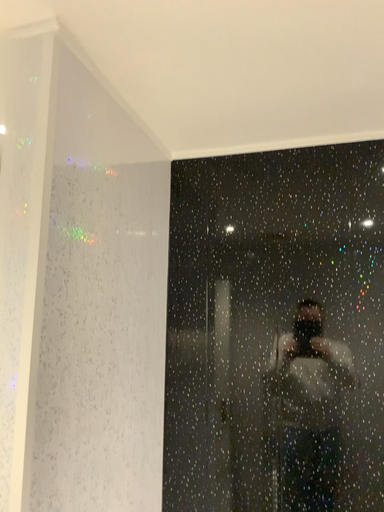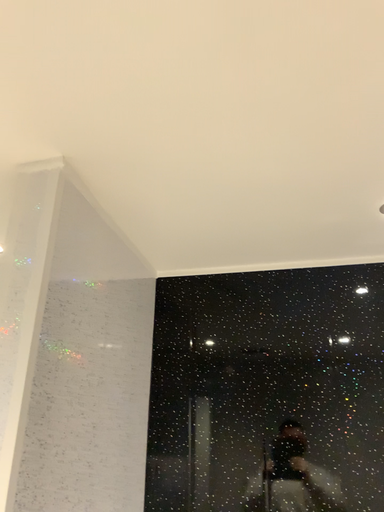
Question: How did the camera likely rotate when shooting the video?

Choices:
 (A) rotated downward
 (B) rotated upward

Answer: (B)